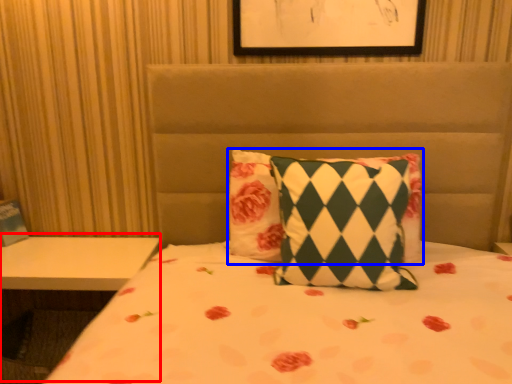
Question: Among these objects, which one is nearest to the camera, table (highlighted by a red box) or pillow (highlighted by a blue box)?

Choices:
 (A) table
 (B) pillow

Answer: (B)